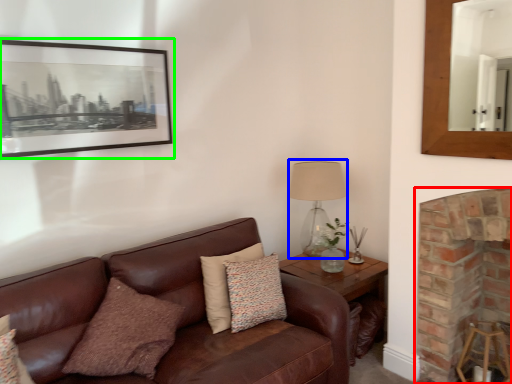
Question: Considering the real-world distances, which object is farthest from fireplace (highlighted by a red box)? table lamp (highlighted by a blue box) or picture frame (highlighted by a green box)?

Choices:
 (A) table lamp
 (B) picture frame

Answer: (B)